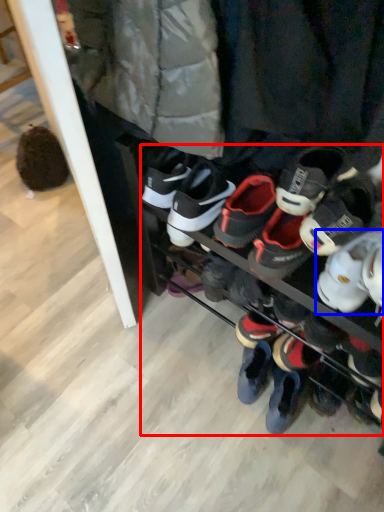
Question: Which point is closer to the camera, footwear (highlighted by a red box) or footwear (highlighted by a blue box)?

Choices:
 (A) footwear
 (B) footwear

Answer: (A)